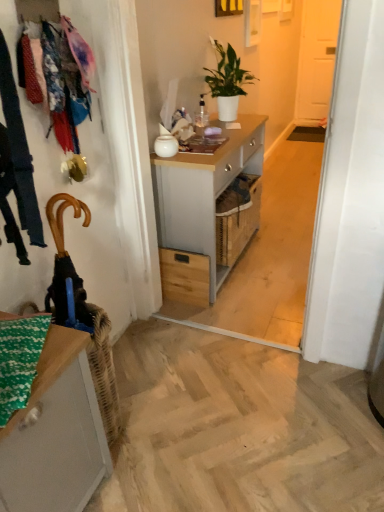
Find the location of a particular element. vacant area located to the right-hand side of white glossy vase at center is located at coordinates (205, 154).